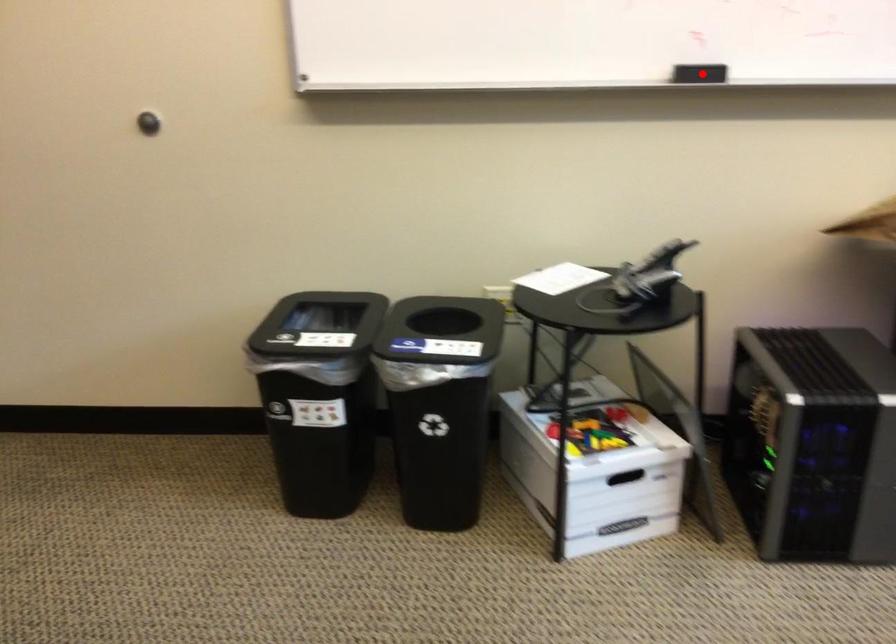
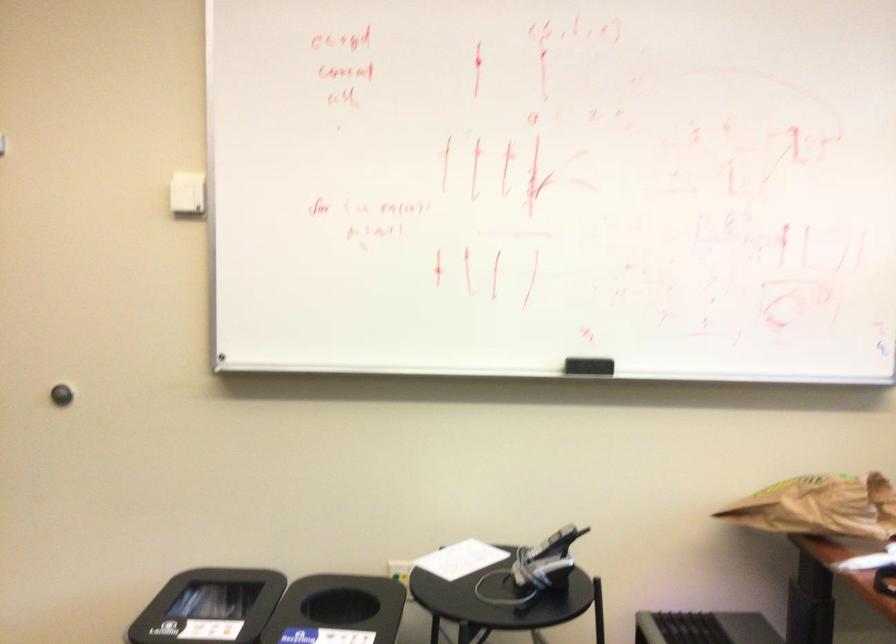
Question: I am providing you with two images of the same scene from different viewpoints. A red point is shown in image1. For the corresponding object point in image2, is it positioned nearer or farther from the camera?

Choices:
 (A) Nearer
 (B) Farther

Answer: (B)